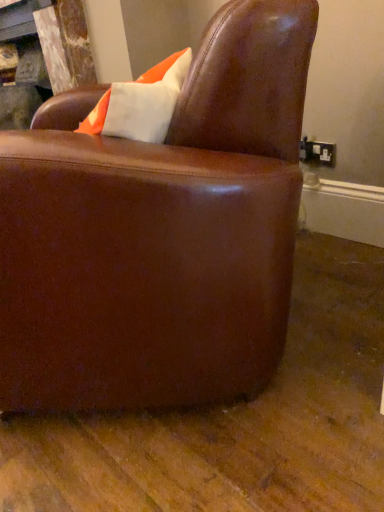
What do you see at coordinates (159, 232) in the screenshot?
I see `matte brown leather armchair at center` at bounding box center [159, 232].

Locate an element on the screen. Image resolution: width=384 pixels, height=512 pixels. matte brown leather armchair at center is located at coordinates (159, 232).

I want to click on matte brown leather armchair at center, so click(x=159, y=232).